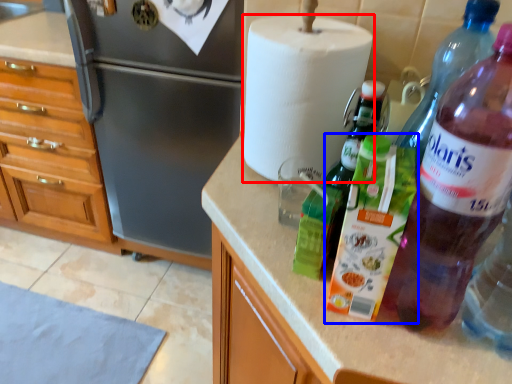
Question: Which point is further to the camera, paper towel (highlighted by a red box) or bottle (highlighted by a blue box)?

Choices:
 (A) paper towel
 (B) bottle

Answer: (A)